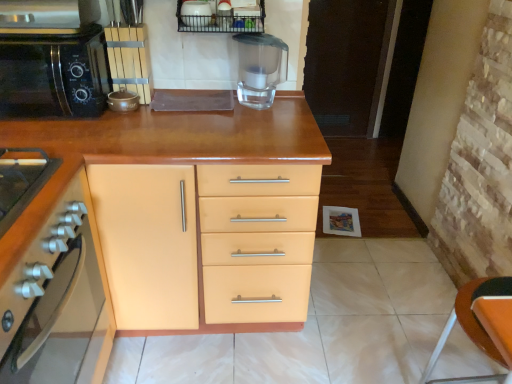
Identify the location of empty space that is to the right of black matte microwave at left. This screenshot has height=384, width=512. (135, 129).